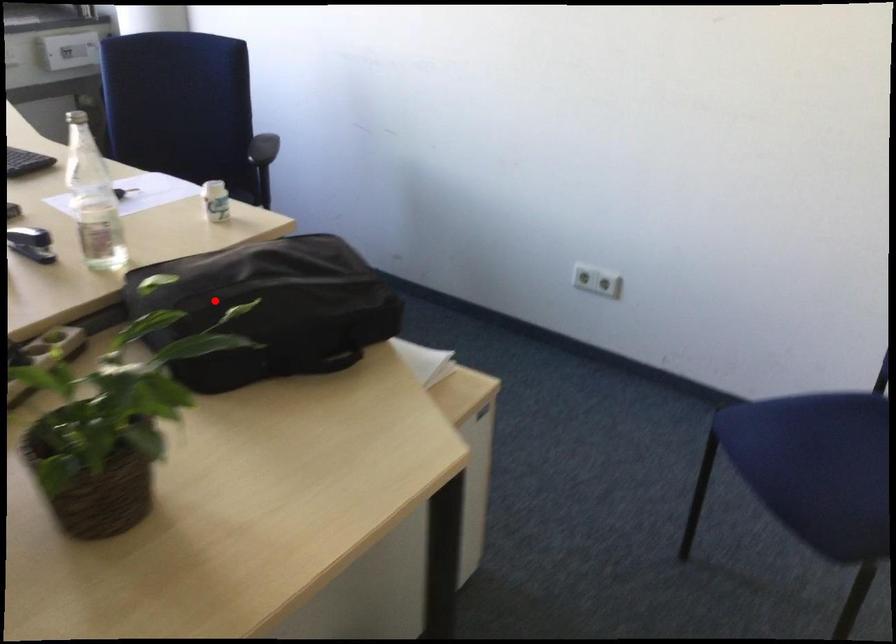
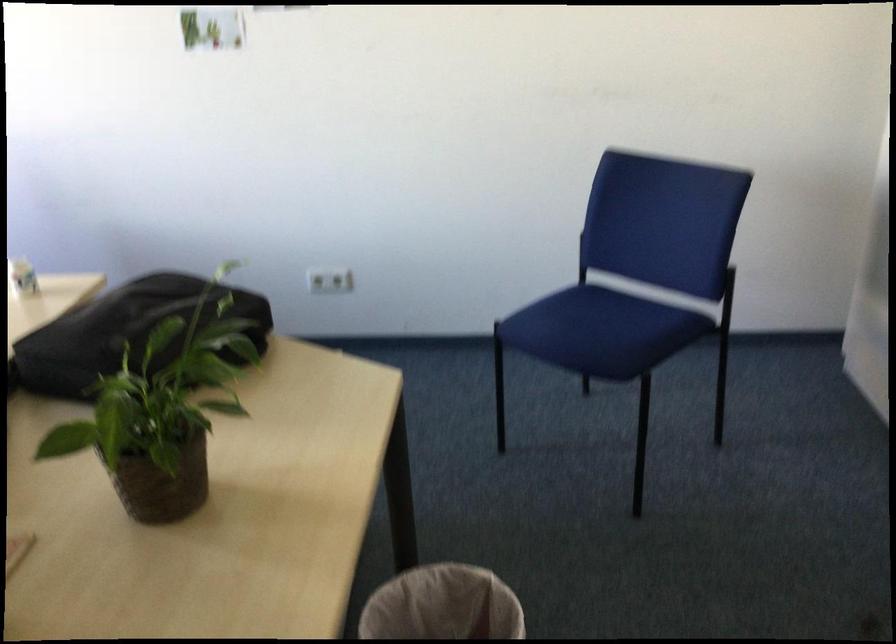
The point at the highlighted location is marked in the first image. Where is the corresponding point in the second image?

(125, 333)